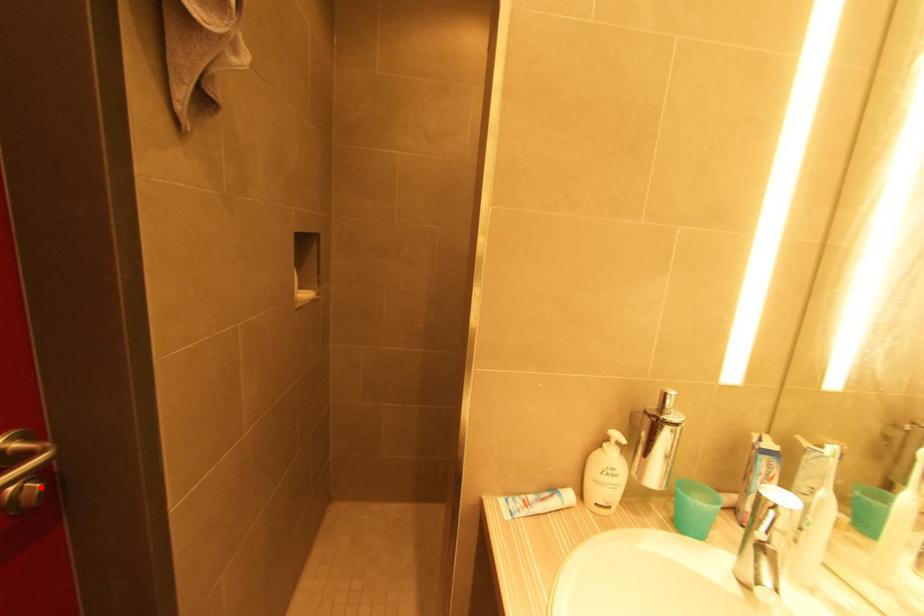
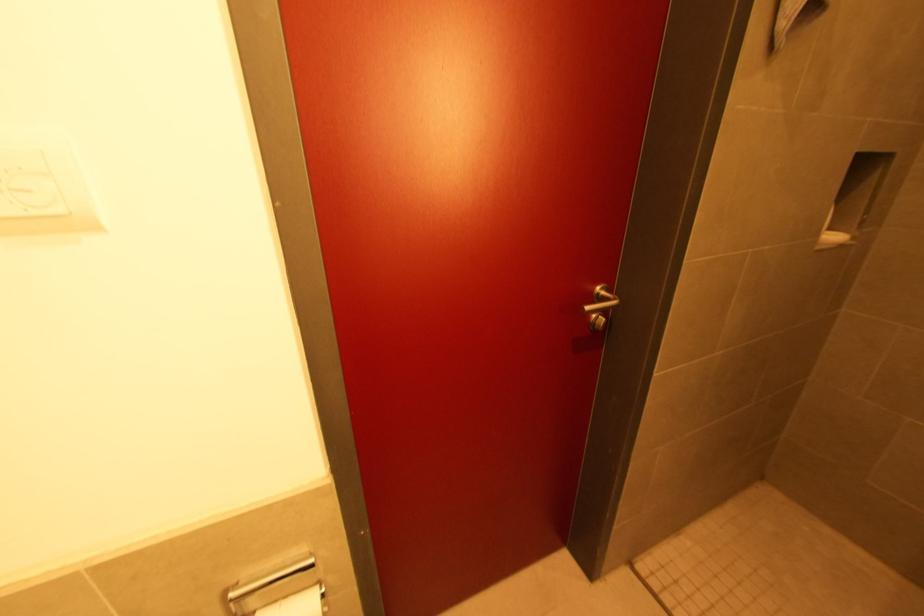
Where in the second image is the point corresponding to the highlighted location from the first image?

(606, 321)